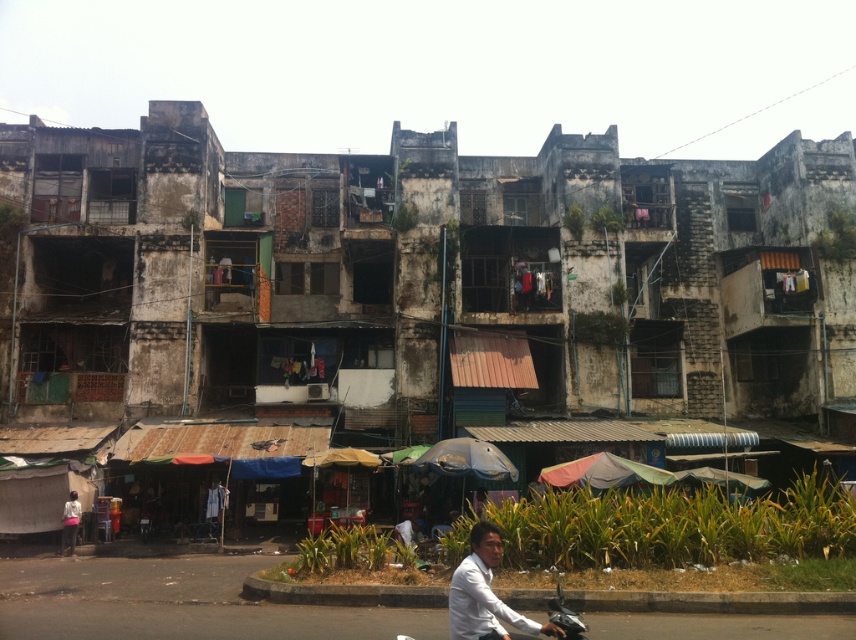
Is white matte shirt at lower center taller than metallic silver motorcycle at lower center?

Yes, white matte shirt at lower center is taller than metallic silver motorcycle at lower center.

Who is positioned more to the right, white matte shirt at lower center or metallic silver motorcycle at lower center?

From the viewer's perspective, white matte shirt at lower center appears more on the right side.

Describe the element at coordinates (484, 593) in the screenshot. I see `white matte shirt at lower center` at that location.

The height and width of the screenshot is (640, 856). Find the location of `white matte shirt at lower center`. white matte shirt at lower center is located at coordinates (x=484, y=593).

Between rusty metal hut at lower center and white matte shirt at lower left, which one has more height?

Standing taller between the two is rusty metal hut at lower center.

Describe the element at coordinates (418, 278) in the screenshot. I see `rusty metal hut at lower center` at that location.

Between point (682, 220) and point (70, 536), which one is positioned in front?

Point (70, 536) is more forward.

Find the location of a particular element. Image resolution: width=856 pixels, height=640 pixels. rusty metal hut at lower center is located at coordinates pyautogui.click(x=418, y=278).

Which is more to the left, metallic silver motorcycle at lower center or white matte shirt at lower left?

white matte shirt at lower left

Does metallic silver motorcycle at lower center have a larger size compared to white matte shirt at lower left?

No, metallic silver motorcycle at lower center is not bigger than white matte shirt at lower left.

Is point (553, 611) closer to camera compared to point (67, 534)?

Yes, point (553, 611) is closer to viewer.

You are a GUI agent. You are given a task and a screenshot of the screen. Output one action in this format:
    pyautogui.click(x=<x>, y=<y>)
    Task: Click on the metallic silver motorcycle at lower center
    
    Given the screenshot: What is the action you would take?
    pyautogui.click(x=506, y=616)